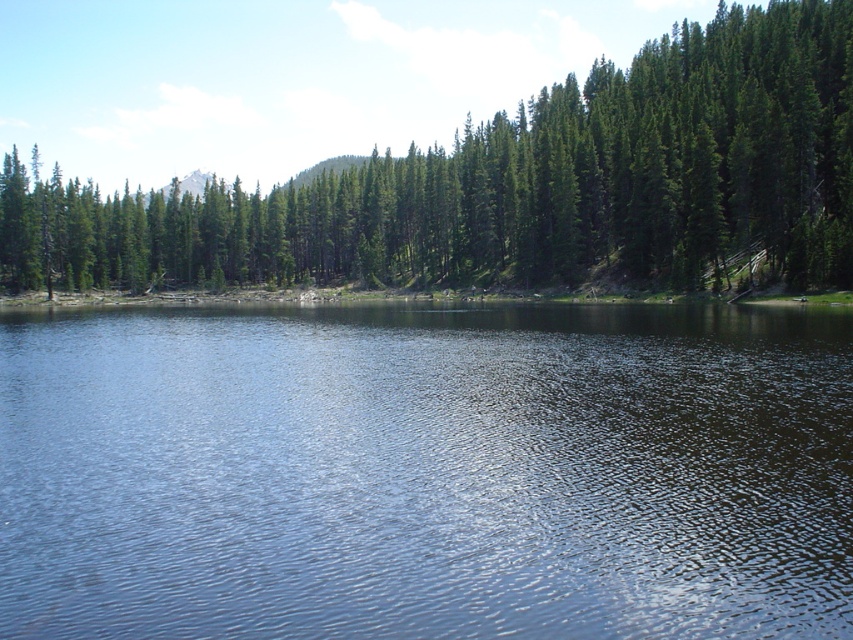
You are standing at the edge of the water and want to take a photo of the green matte tree at upper center. Since the clear water at center is between you and the tree, will the tree be visible in the reflection of the water?

The clear water at center is in front of the green matte tree at upper center, so the tree is behind the water. Since the water is clear, the tree should be visible in the reflection if the angle allows, but because the water is in front of the tree, the reflection might not show the tree directly unless the water is still enough and positioned correctly.

You are standing at the origin point of the image, which is at the bottom left corner. You want to walk to the clear water at center. In which direction should you move first? Please provide your answer in terms of coordinate directions like North, South, East, or West.

The clear water at center is located at coordinate point (426,472). Since you are starting at the origin point at the bottom left corner, moving East would increase your x coordinate. Therefore, you should move East to reach the clear water at center.